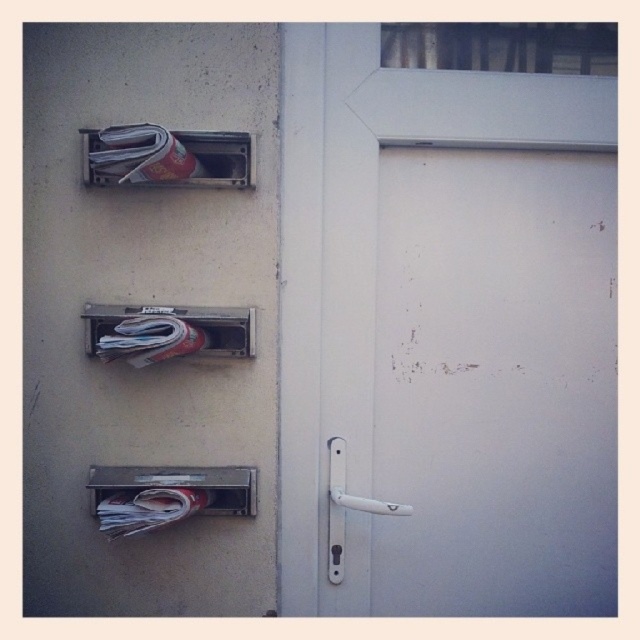
Does white matte door at center have a greater height compared to metallic newspaper at upper left?

Correct, white matte door at center is much taller as metallic newspaper at upper left.

Does white matte door at center have a greater width compared to metallic newspaper at upper left?

A: Yes.

Which is in front, point (528, 257) or point (148, 138)?

Point (148, 138)

I want to click on white matte door at center, so click(x=445, y=337).

Who is higher up, metallic newspaper at center or white plastic door handle at center?

Positioned higher is metallic newspaper at center.

Image resolution: width=640 pixels, height=640 pixels. What are the coordinates of `metallic newspaper at center` in the screenshot? It's located at (168, 332).

Locate an element on the screen. The image size is (640, 640). metallic newspaper at center is located at coordinates (168, 332).

Who is more distant from viewer, (144, 147) or (173, 352)?

The point (173, 352) is behind.

The image size is (640, 640). Identify the location of metallic newspaper at upper left. (168, 156).